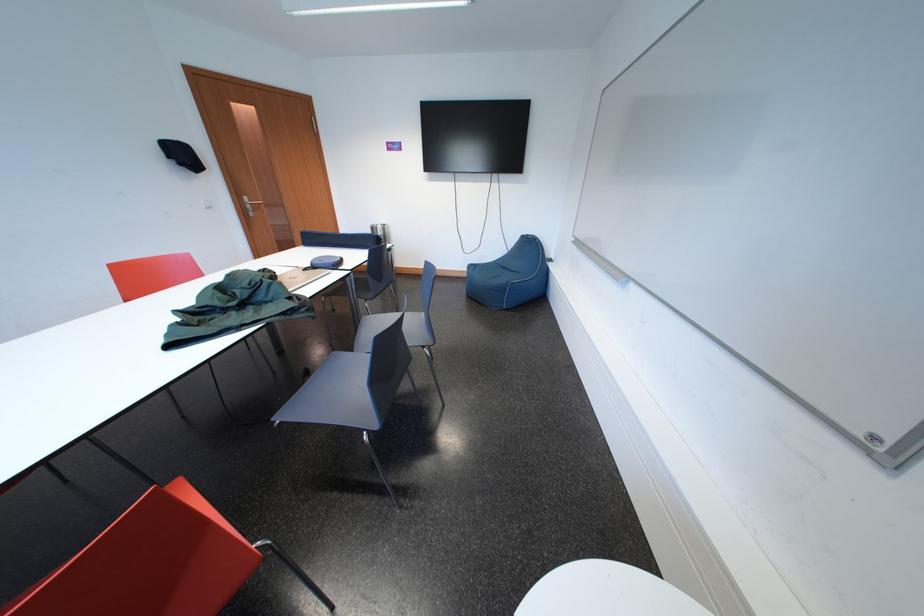
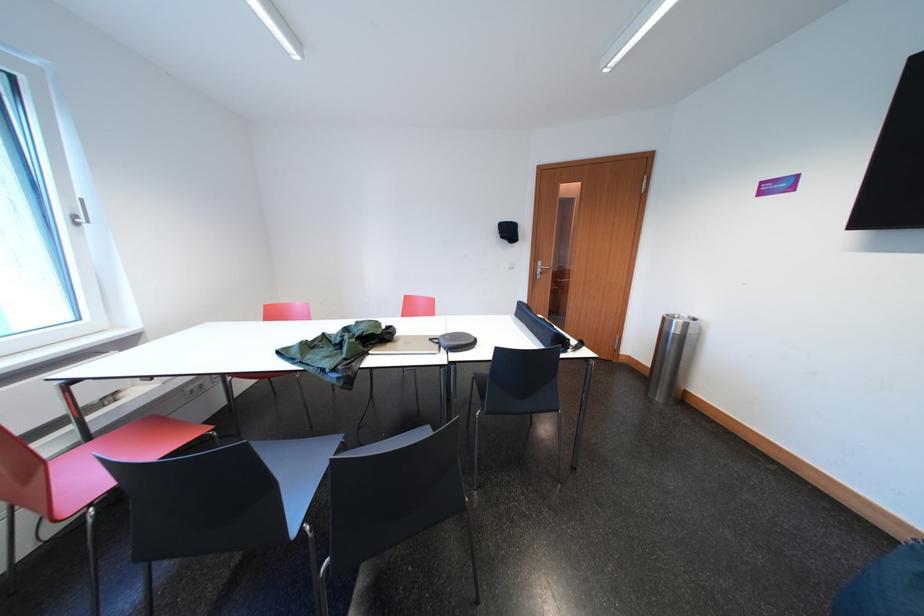
In the second image, find the point that corresponds to the point at 383,233 in the first image.

(675, 325)